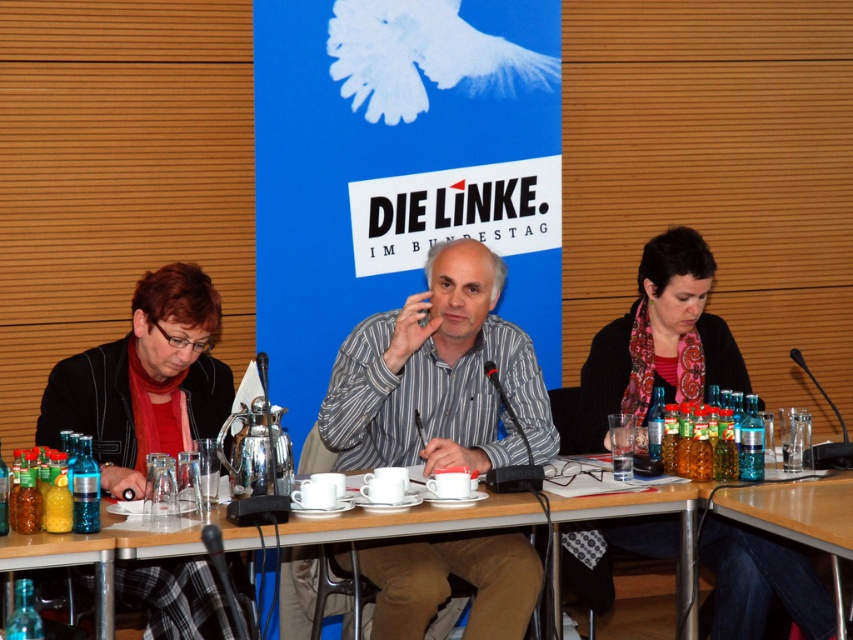
Does striped cotton shirt at center have a lesser width compared to wooden table at lower right?

Incorrect, striped cotton shirt at center's width is not less than wooden table at lower right's.

Is striped cotton shirt at center to the right of wooden table at lower right from the viewer's perspective?

Incorrect, striped cotton shirt at center is not on the right side of wooden table at lower right.

This screenshot has height=640, width=853. Find the location of `striped cotton shirt at center`. striped cotton shirt at center is located at coordinates (437, 376).

Who is higher up, striped cotton shirt at center or dark gray sweater at center?

dark gray sweater at center is higher up.

How far apart are striped cotton shirt at center and dark gray sweater at center?

24.30 inches

Does point (442, 560) come farther from viewer compared to point (674, 298)?

No, it is in front of (674, 298).

This screenshot has width=853, height=640. I want to click on striped cotton shirt at center, so click(x=437, y=376).

Is dark gray sweater at center wider than wooden table at center?

No.

Which is in front, point (665, 260) or point (692, 552)?

Positioned in front is point (692, 552).

Locate an element on the screen. This screenshot has height=640, width=853. dark gray sweater at center is located at coordinates (659, 340).

Where is `dark gray sweater at center`? dark gray sweater at center is located at coordinates (659, 340).